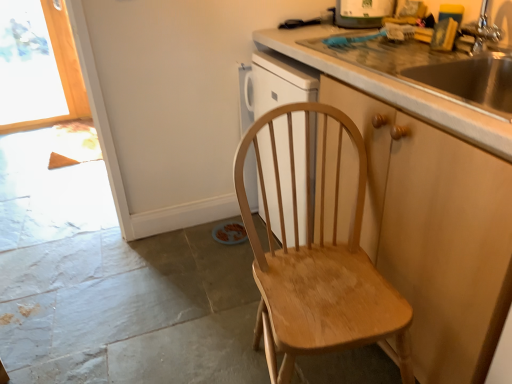
Locate an element on the screen. The image size is (512, 384). vacant area situated to the left side of light brown wooden chair at center is located at coordinates pos(182,347).